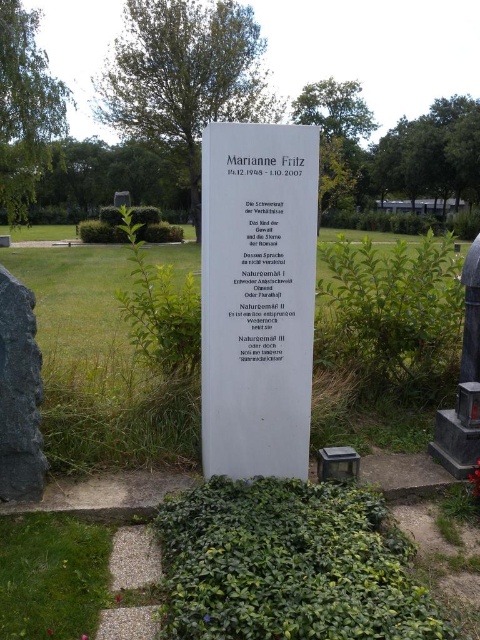
Between white stone plaque at center and matte stone monument at right, which one appears on the right side from the viewer's perspective?

Positioned to the right is matte stone monument at right.

Can you confirm if white stone plaque at center is bigger than matte stone monument at right?

Yes, white stone plaque at center is bigger than matte stone monument at right.

Describe the element at coordinates (257, 298) in the screenshot. The width and height of the screenshot is (480, 640). I see `white stone plaque at center` at that location.

Identify the location of white stone plaque at center. [257, 298].

Does white stone plaque at center appear over black paper at center?

No, white stone plaque at center is not above black paper at center.

Who is more distant from viewer, (264, 157) or (297, 204)?

The point (297, 204) is behind.

Locate an element on the screen. The image size is (480, 640). white stone plaque at center is located at coordinates (257, 298).

Is point (286, 260) closer to viewer compared to point (477, 305)?

Yes, it is.

Is black paper at center positioned in front of matte stone monument at right?

Yes, it is.

Is point (230, 164) positioned in front of point (467, 404)?

Yes, it is in front of point (467, 404).

Where is `black paper at center`? This screenshot has height=640, width=480. black paper at center is located at coordinates (269, 257).